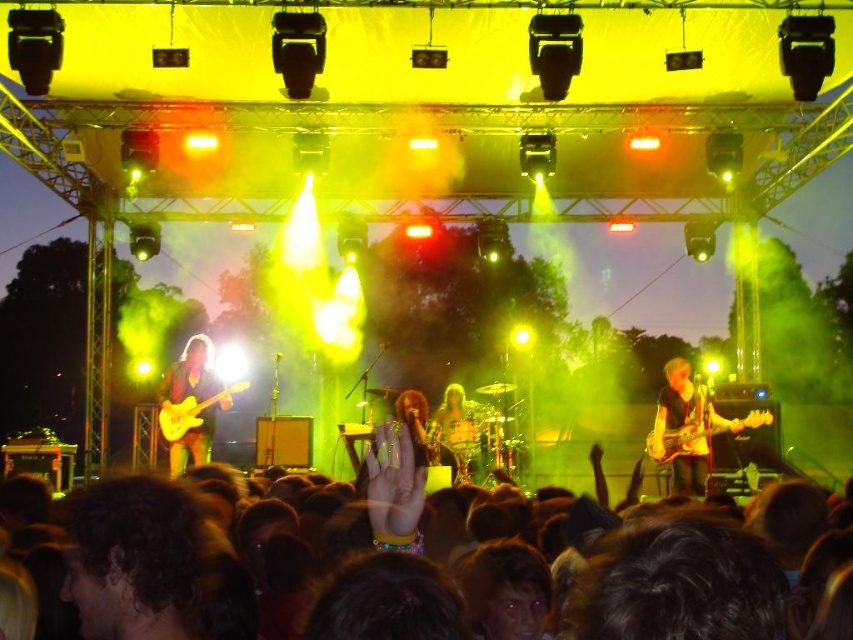
You are a photographer trying to capture the drummer who is singing. You notice the dark brown hair at lower center and the shiny gold guitar at left. Which object is closer to the camera based on their height?

The dark brown hair at lower center is shorter than the shiny gold guitar at left, so the shiny gold guitar at left is closer to the camera since it is taller.

You are a photographer standing at the front of the stage during the concert. You notice two points marked in the image. Which point, point [665,413] or point [685,440], is closer to your camera lens?

Point [665,413] is further to the camera than point [685,440], so point [685,440] is closer to the camera lens.